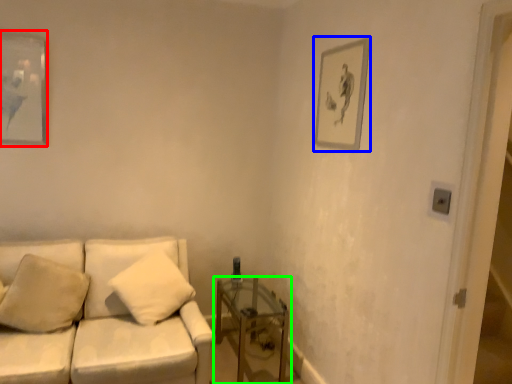
Question: Which object is the closest to the picture frame (highlighted by a red box)? Choose among these: picture frame (highlighted by a blue box) or table (highlighted by a green box).

Choices:
 (A) picture frame
 (B) table

Answer: (B)